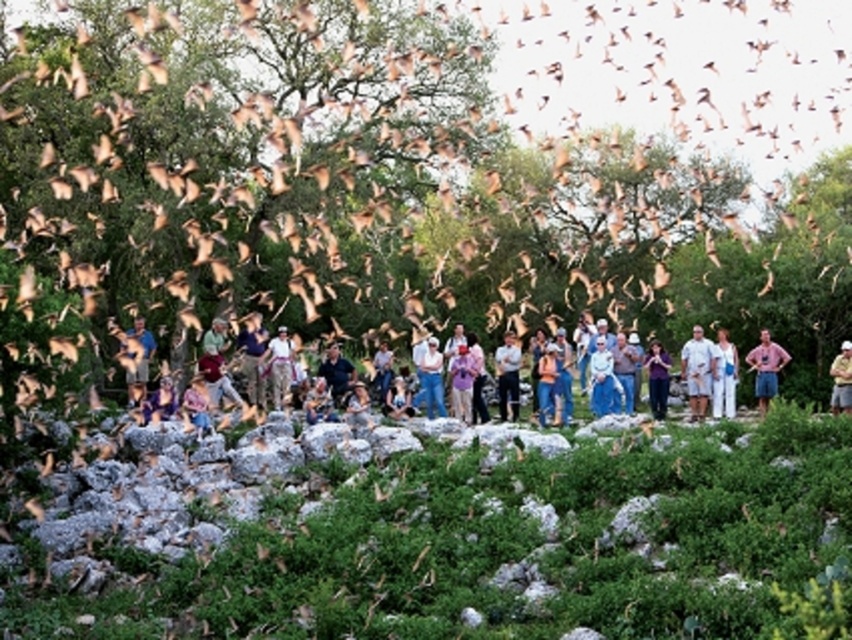
You are standing in the scene and see the pink cotton shirt at right and the khaki cotton shirt at center. Which shirt is positioned to the left?

The pink cotton shirt at right is positioned to the left of the khaki cotton shirt at center.

Which shirt is wider, the pink cotton shirt at right or the white cotton shirt at center?

The pink cotton shirt at right is wider than the white cotton shirt at center.

You are standing at the edge of the rocky outcrop and see the pink cotton shirt at right and the white cotton shirt at center. Which shirt is closer to you?

The pink cotton shirt at right is closer to you because it is in front of the white cotton shirt at center.